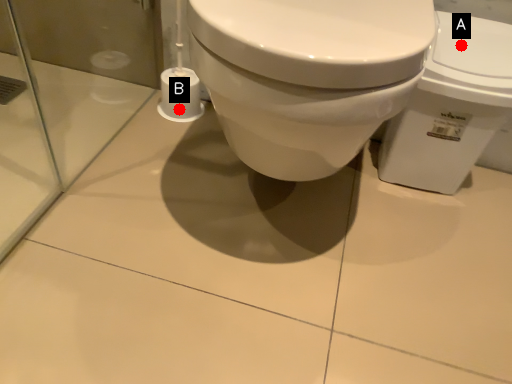
Question: Two points are circled on the image, labeled by A and B beside each circle. Which of the following is the farthest from the observer?

Choices:
 (A) A is further
 (B) B is further

Answer: (B)